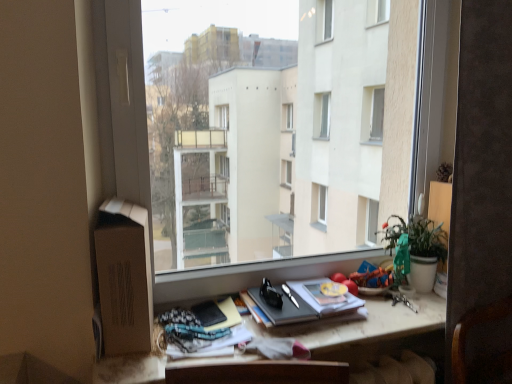
Question: From a real-world perspective, relative to matte wooden desk at center, is matte black notebook at lower center, the 1th paperback book in the left-to-right sequence, vertically above or below?

Choices:
 (A) above
 (B) below

Answer: (A)

Question: Considering their positions, is matte black notebook at lower center, positioned as the second paperback book in right-to-left order, located in front of or behind matte wooden desk at center?

Choices:
 (A) front
 (B) behind

Answer: (B)

Question: Based on their relative distances, which object is farther from the matte wooden desk at center?

Choices:
 (A) hardcover book at center, which is counted as the second paperback book, starting from the left
 (B) green matte plant at right
 (C) matte black notebook at lower center, positioned as the second paperback book in right-to-left order
 (D) transparent glass window at center

Answer: (D)

Question: Based on their relative distances, which object is nearer to the hardcover book at center, which ranks as the 1th paperback book in right-to-left order?

Choices:
 (A) matte black notebook at lower center, positioned as the second paperback book in right-to-left order
 (B) transparent glass window at center
 (C) green matte plant at right
 (D) matte wooden desk at center

Answer: (D)